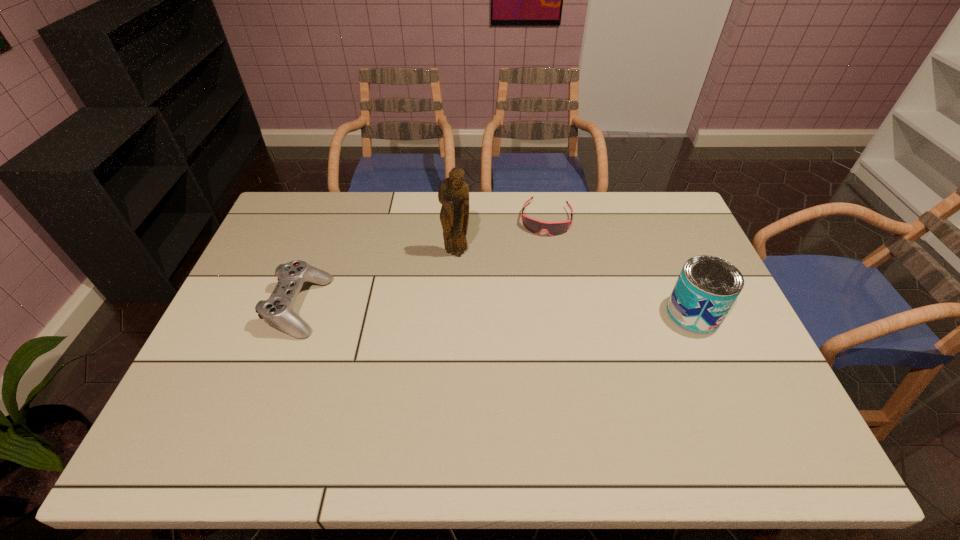
Find the location of a particular element. vacant space that satisfies the following two spatial constraints: 1. on the front side of the second tallest object; 2. on the left side of the tallest object is located at coordinates (453, 313).

Where is `vacant region that satisfies the following two spatial constraints: 1. on the back side of the third object from right to left; 2. on the left side of the goggles`? This screenshot has width=960, height=540. vacant region that satisfies the following two spatial constraints: 1. on the back side of the third object from right to left; 2. on the left side of the goggles is located at coordinates (459, 219).